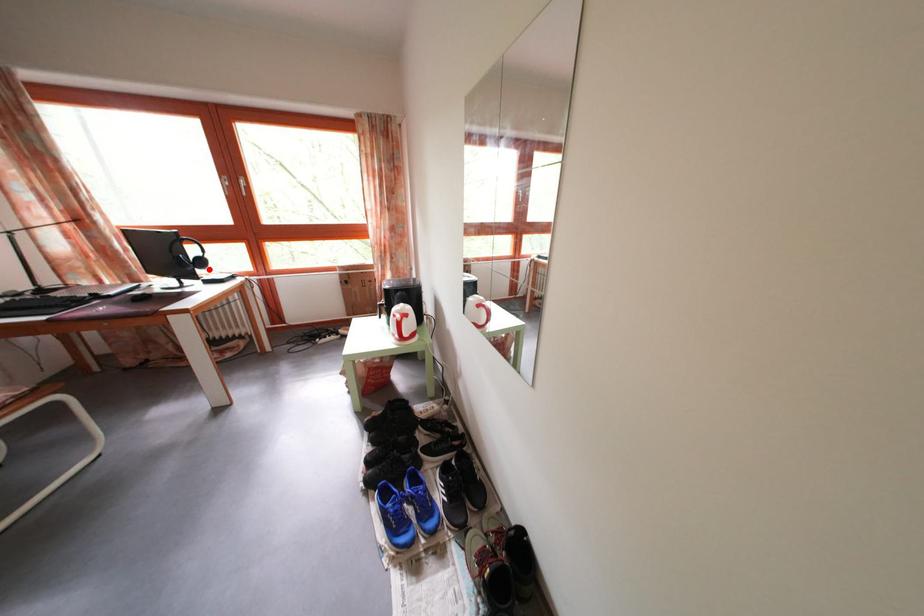
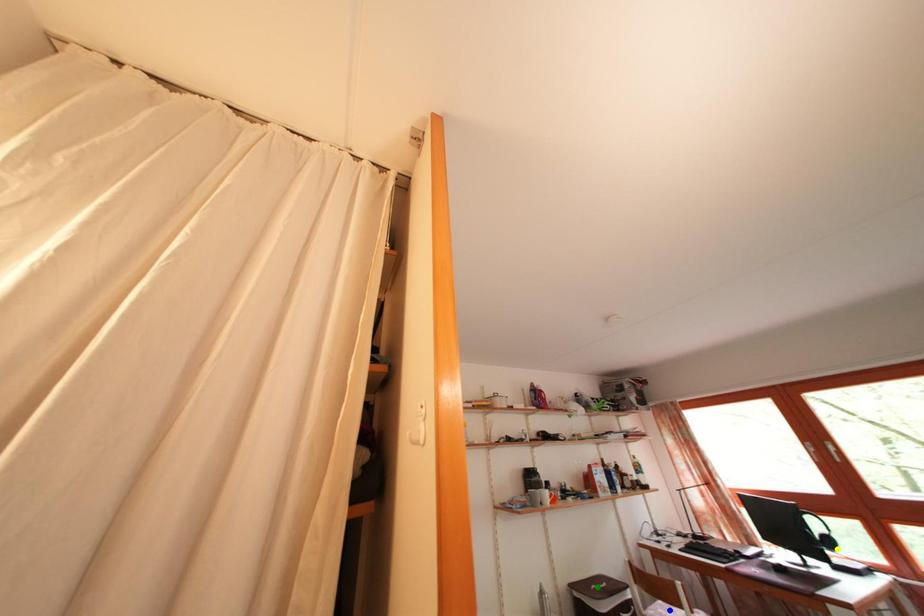
Question: I am providing you with two images of the same scene from different viewpoints. A red point is marked on the first image. You are given multiple points on the second image. Which point in image 2 represents the same 3d spot as the red point in image 1?

Choices:
 (A) yellow point
 (B) green point
 (C) blue point

Answer: (A)